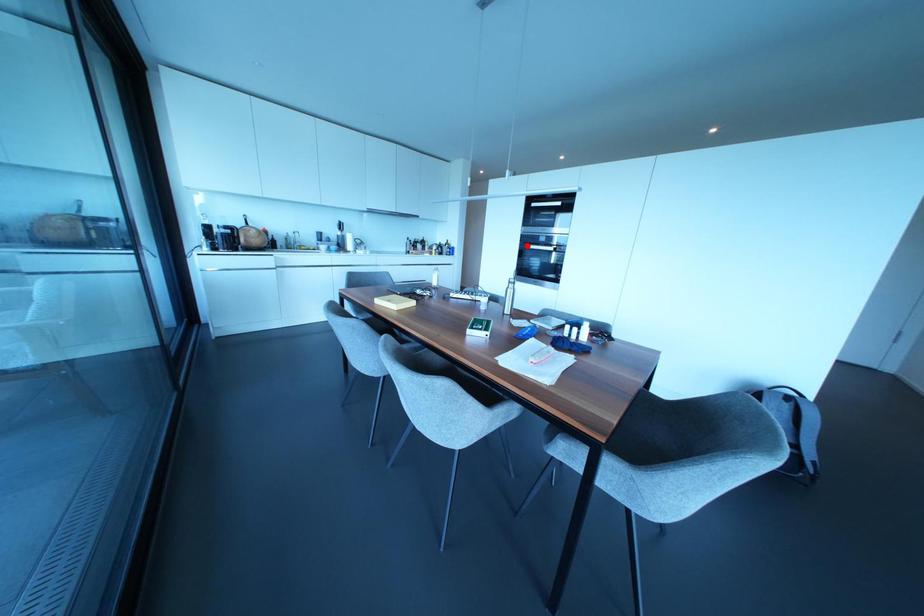
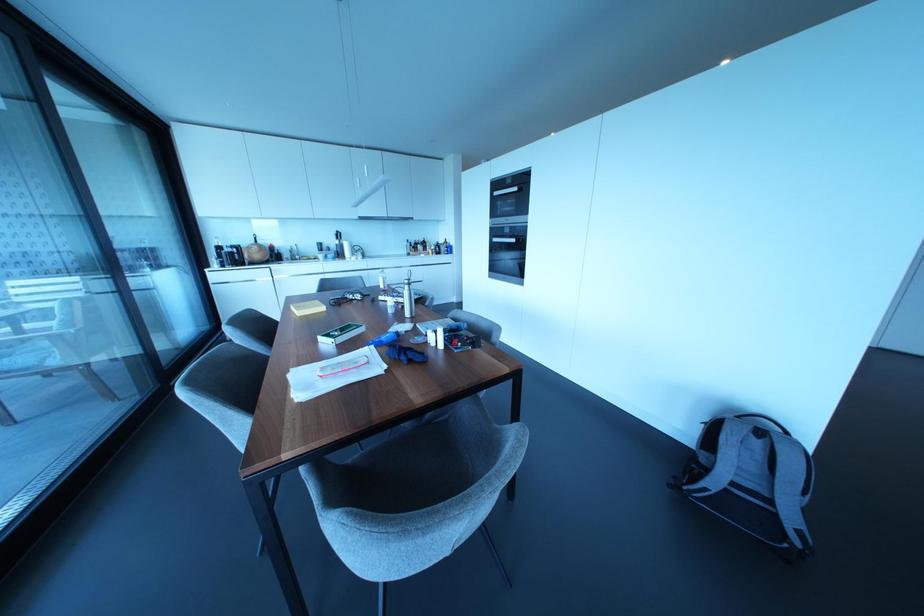
Question: I am providing you with two images of the same scene from different viewpoints. Image1 has a red point marked. In image2, the corresponding 3D location appears at what relative position? Reply with the corresponding letter.

Choices:
 (A) Closer
 (B) Farther

Answer: (A)